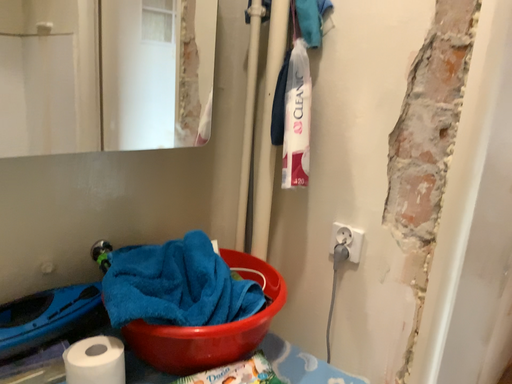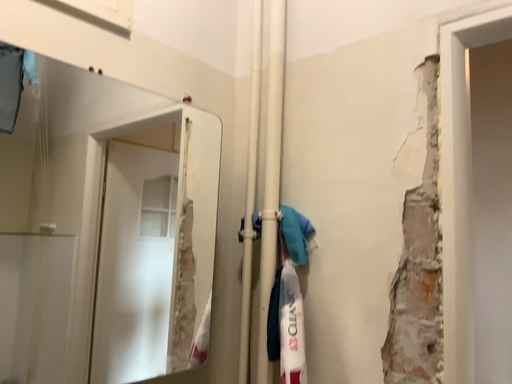
Question: Which way did the camera rotate in the video?

Choices:
 (A) rotated upward
 (B) rotated downward

Answer: (A)